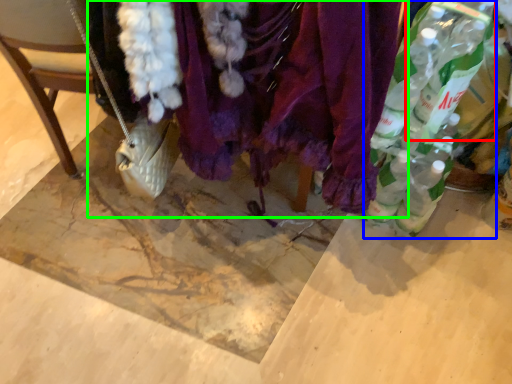
Question: Estimate the real-world distances between objects in this image. Which object is closer to bottle (highlighted by a red box), bottle (highlighted by a blue box) or textile (highlighted by a green box)?

Choices:
 (A) bottle
 (B) textile

Answer: (A)